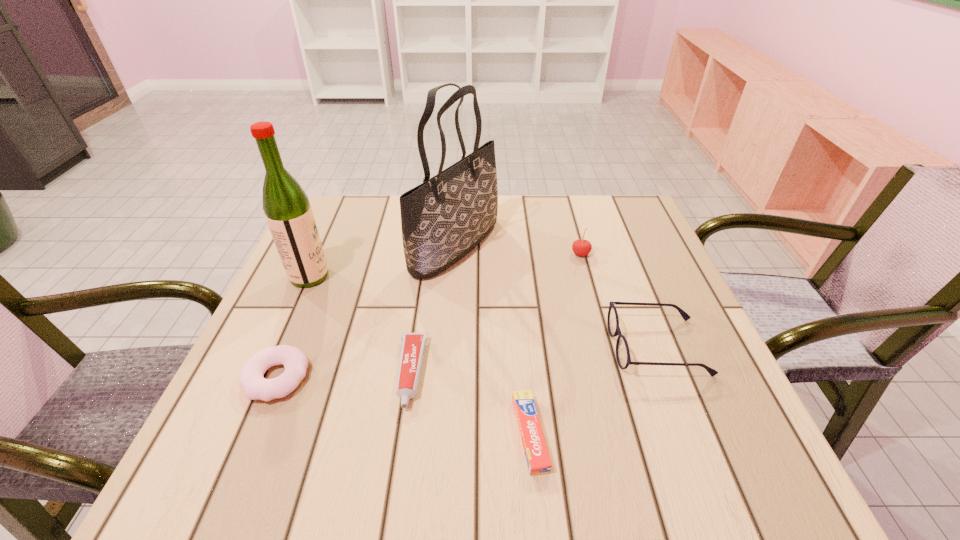
Locate an element on the screen. free location located 0.310m on the left of the third tallest object is located at coordinates (445, 254).

Find the location of a particular element. This screenshot has width=960, height=540. free space located 0.340m on the front-facing side of the fourth tallest object is located at coordinates (439, 347).

This screenshot has width=960, height=540. What are the coordinates of `vacant area located 0.070m on the front-facing side of the fourth tallest object` in the screenshot? It's located at (577, 347).

Where is `blank space located 0.270m on the front-facing side of the fourth tallest object`? The height and width of the screenshot is (540, 960). blank space located 0.270m on the front-facing side of the fourth tallest object is located at coordinates (475, 347).

You are a GUI agent. You are given a task and a screenshot of the screen. Output one action in this format:
    pyautogui.click(x=<x>, y=<y>)
    Task: Click on the blank space located 0.110m at the nozzle of the taller toothpaste
    Image resolution: width=960 pixels, height=540 pixels.
    Given the screenshot: What is the action you would take?
    pyautogui.click(x=396, y=476)

Where is `vacant area located 0.310m on the back of the doughnut`? The height and width of the screenshot is (540, 960). vacant area located 0.310m on the back of the doughnut is located at coordinates (328, 253).

You are a GUI agent. You are given a task and a screenshot of the screen. Output one action in this format:
    pyautogui.click(x=<x>, y=<y>)
    Task: Click on the vacant point located 0.050m on the back of the shortest object
    The width and height of the screenshot is (960, 540).
    Given the screenshot: What is the action you would take?
    pyautogui.click(x=524, y=374)

I want to click on object that is positioned at the far edge, so click(x=443, y=219).

Where is `object that is at the near edge`? The height and width of the screenshot is (540, 960). object that is at the near edge is located at coordinates (538, 461).

Find the location of a particular element. liquor located in the left edge section of the desktop is located at coordinates (288, 212).